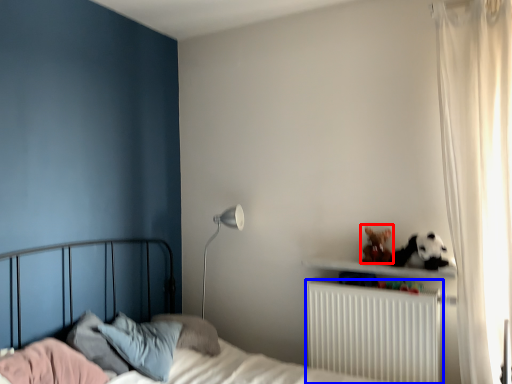
Question: Which object appears closest to the camera in this image, stuff (highlighted by a red box) or radiator (highlighted by a blue box)?

Choices:
 (A) stuff
 (B) radiator

Answer: (B)